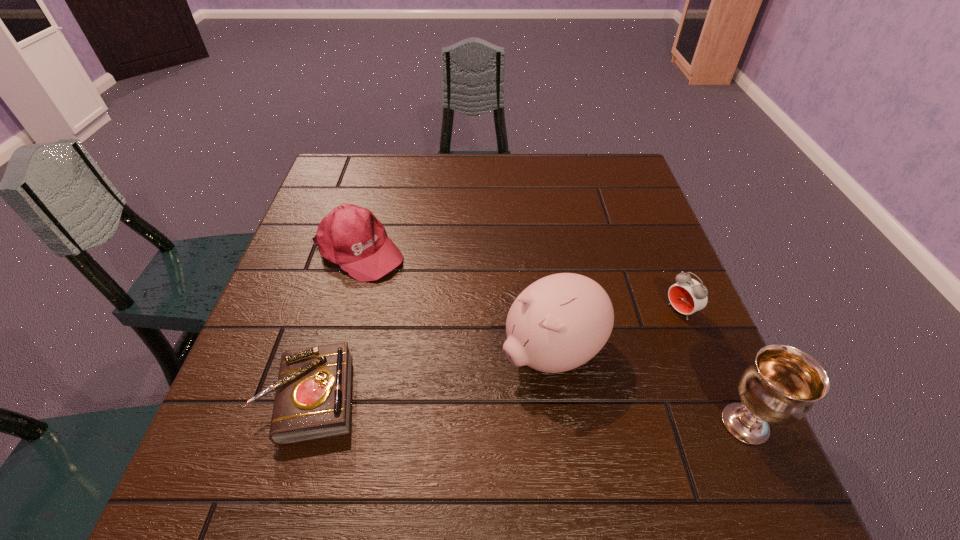
The image size is (960, 540). I want to click on vacant area between the baseball cap and the alarm clock, so click(x=519, y=281).

At what (x,y) coordinates should I click in order to perform the action: click on unoccupied area between the alarm clock and the chalice. Please return your answer as a coordinate pair (x, y). The height and width of the screenshot is (540, 960). Looking at the image, I should click on (712, 367).

Identify the location of free space between the shortest object and the alarm clock. (495, 354).

Identify the location of free area in between the baseball cap and the piggy bank. (455, 302).

The width and height of the screenshot is (960, 540). Find the location of `free area in between the shortest object and the alarm clock`. free area in between the shortest object and the alarm clock is located at coordinates (495, 354).

Locate an element on the screen. The image size is (960, 540). empty location between the shortest object and the alarm clock is located at coordinates (495, 354).

Where is `vacant space that is in between the third object from left to right and the shortest object`? vacant space that is in between the third object from left to right and the shortest object is located at coordinates (431, 375).

What are the coordinates of `free space between the baseball cap and the piggy bank` in the screenshot? It's located at (455, 302).

Identify the location of free space between the baseball cap and the piggy bank. (455, 302).

Where is `free space between the alarm clock and the farthest object`? free space between the alarm clock and the farthest object is located at coordinates (519, 281).